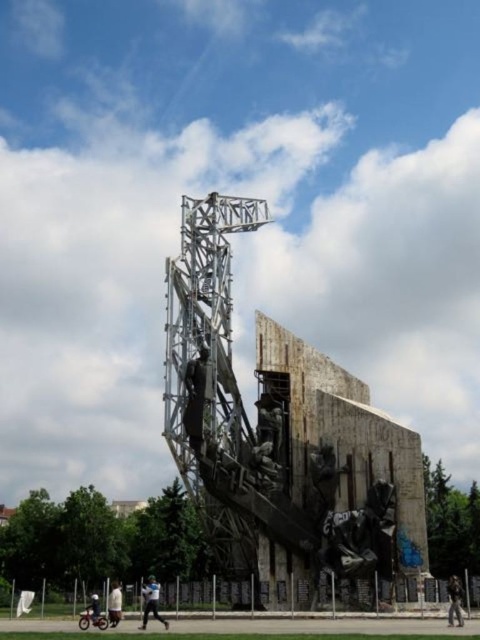
You are a photographer trying to capture the monument from a specific angle. You notice the white cotton shirt at lower left and the dark blue jeans at lower left in your frame. Which of these two items is shorter in height?

The white cotton shirt at lower left is shorter in height than the dark blue jeans at lower left because the description states it is not as tall as the dark blue jeans at lower left.

From the picture: You are a photographer standing 10 meters away from the monument. You want to take a photo that includes both the light blue shirt at center and the dark blue jeans at lower left. Can you fit both in the frame of your camera, which has a maximum field of view of 6 meters?

The distance between the light blue shirt at center and the dark blue jeans at lower left is 5.95 meters, which is less than the camera field of view of 6 meters. Therefore, both can be included in the frame.